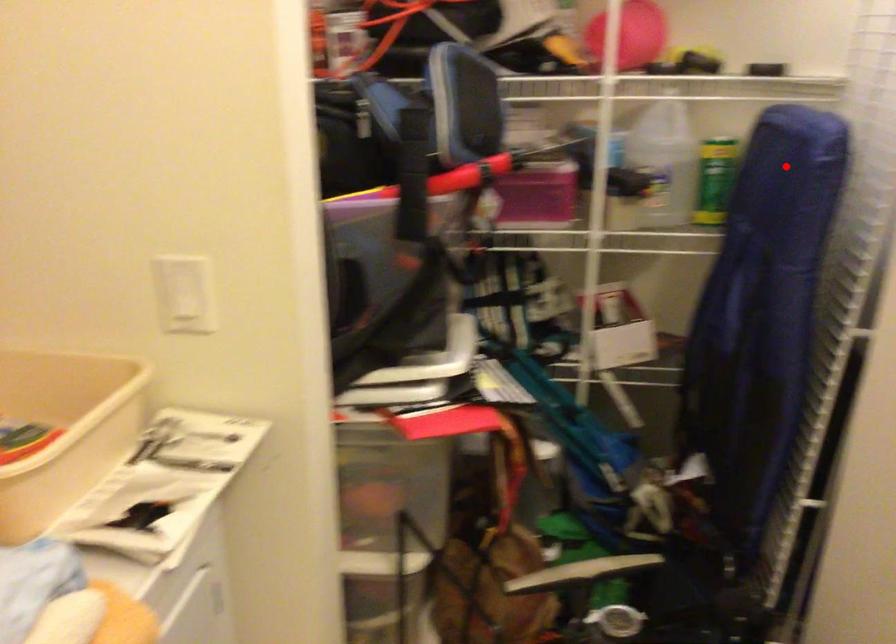
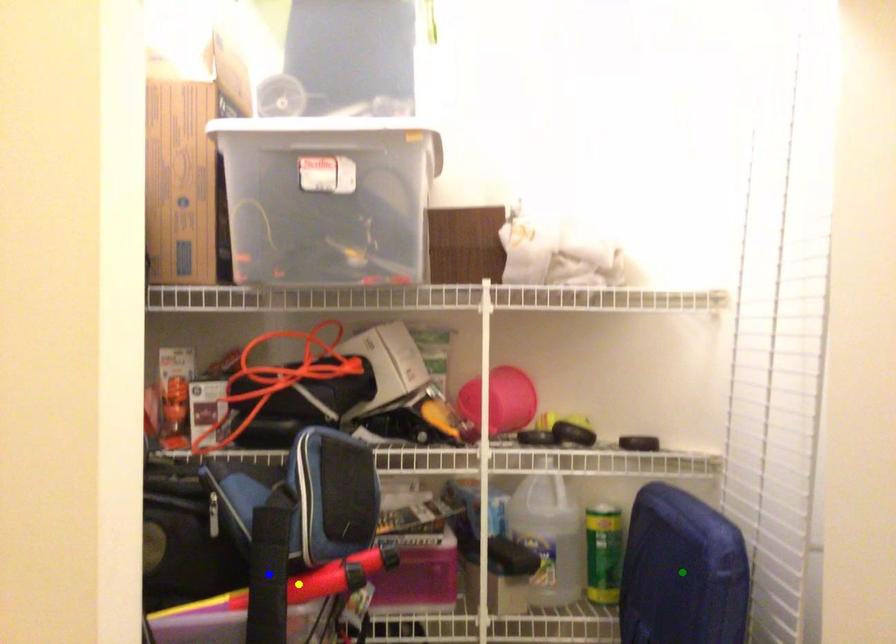
Question: I am providing you with two images of the same scene from different viewpoints. A red point is marked on the first image. You are given multiple points on the second image. Can you choose the point in image 2 that corresponds to the point in image 1?

Choices:
 (A) green point
 (B) yellow point
 (C) blue point

Answer: (A)